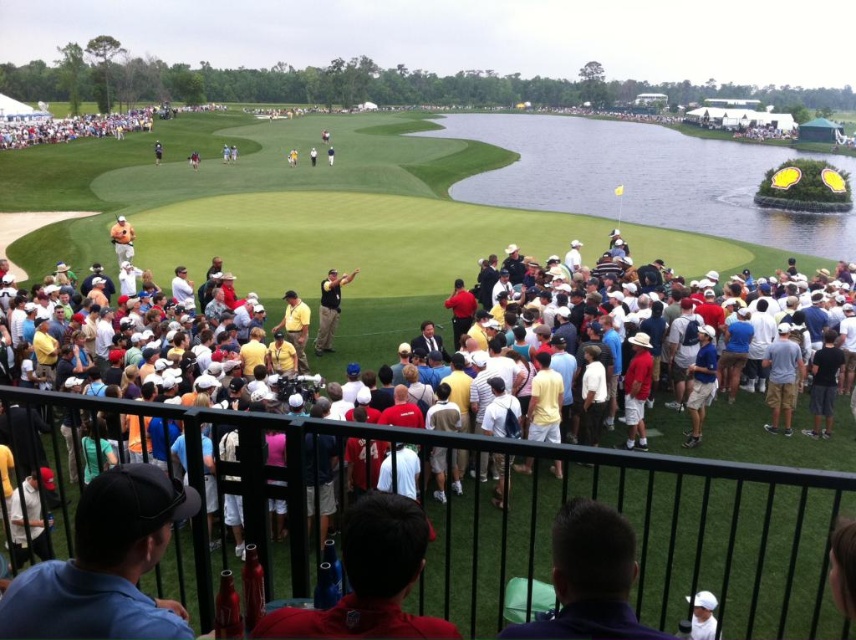
You are a photographer standing at the back of the crowd, aiming to capture a clear shot of the golfer. There are two points marked on your camera screen at coordinates point (603,205) and point (536,394). Which point is closer to your camera lens?

Point (536,394) is closer to the camera lens because the description states that point (603,205) is further away than point (536,394).

You are a photographer standing at the point labeled as point (770,422). You want to take a picture of the golfer in orange who is near the hole. The camera you are using has a maximum range of 120 feet. Will you be able to capture the golfer in orange in your photo?

The distance between point (770,422) and the camera is 115.65 feet, which is within the camera maximum range of 120 feet. Therefore, you can capture the golfer in orange in your photo.